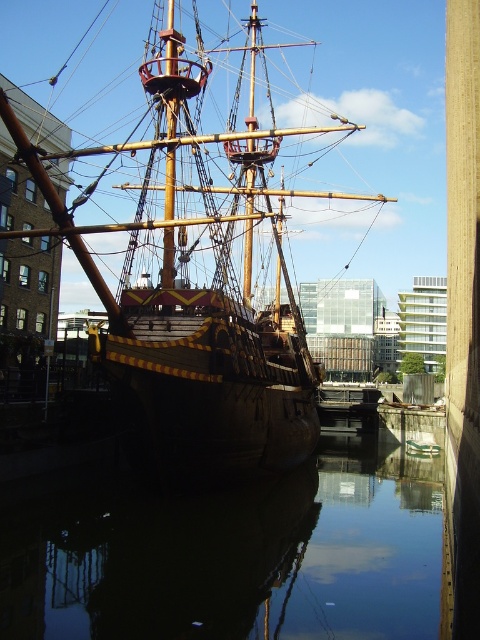
Does wooden ship at center appear over smooth dark water at center?

Yes, wooden ship at center is above smooth dark water at center.

This screenshot has width=480, height=640. What do you see at coordinates (197, 273) in the screenshot? I see `wooden ship at center` at bounding box center [197, 273].

Where is `wooden ship at center`? This screenshot has height=640, width=480. wooden ship at center is located at coordinates (197, 273).